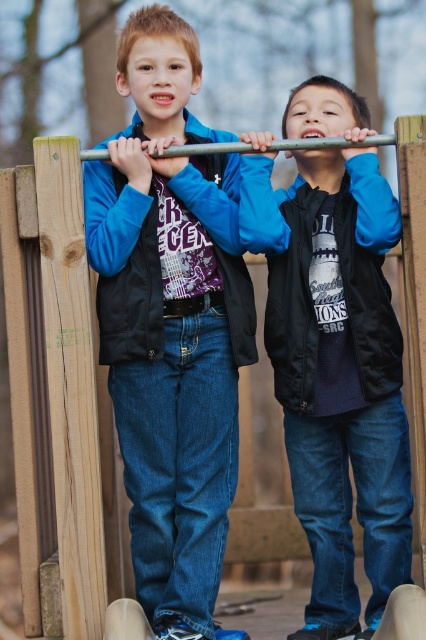
Question: Is black matte vest at center further to camera compared to metallic pole at center?

Choices:
 (A) yes
 (B) no

Answer: (B)

Question: Which point is farther from the camera taking this photo?

Choices:
 (A) (385, 138)
 (B) (101, 323)
 (C) (166, 625)

Answer: (B)

Question: From the image, what is the correct spatial relationship of matte black vest at center in relation to black fabric jacket at upper center?

Choices:
 (A) below
 (B) above

Answer: (A)

Question: Which point is closer to the camera?

Choices:
 (A) (131, 282)
 (B) (170, 147)
 (C) (244, 342)

Answer: (B)

Question: Which point is farther from the camera taking this photo?

Choices:
 (A) (190, 170)
 (B) (368, 307)

Answer: (B)

Question: Does matte black vest at center appear on the right side of black fabric jacket at upper center?

Choices:
 (A) no
 (B) yes

Answer: (A)